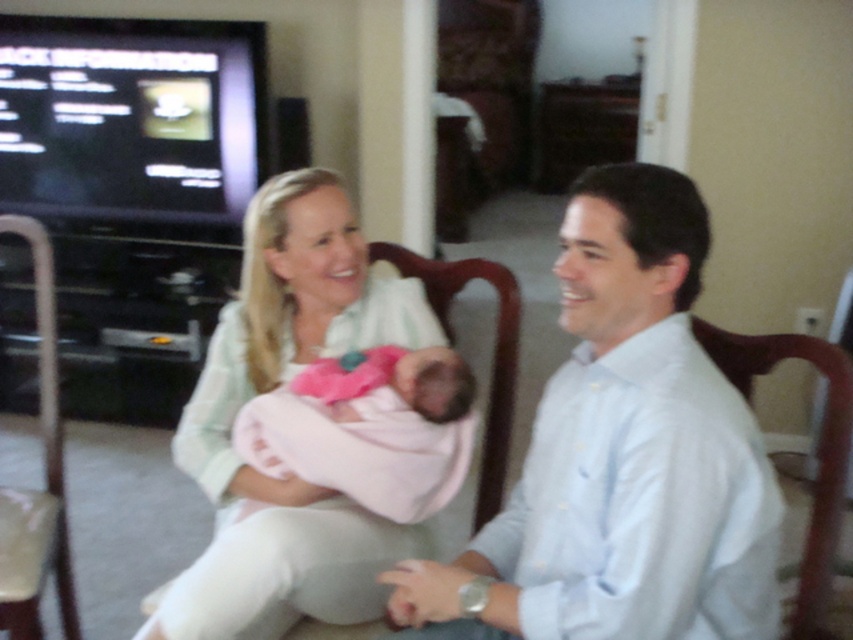
Question: In this image, where is pink fabric newborn at center located relative to light brown leather armchair at left?

Choices:
 (A) right
 (B) left

Answer: (A)

Question: Can you confirm if pink fabric newborn at center is positioned above dark wood armchair at right?

Choices:
 (A) yes
 (B) no

Answer: (A)

Question: Which object is farther from the camera taking this photo?

Choices:
 (A) light blue shirt at right
 (B) dark wood armchair at right
 (C) pink fabric newborn at center
 (D) light green fabric shirt at center

Answer: (C)

Question: Can you confirm if light blue shirt at right is thinner than pink fabric newborn at center?

Choices:
 (A) yes
 (B) no

Answer: (B)

Question: Which of the following is the closest to the observer?

Choices:
 (A) (628, 218)
 (B) (314, 292)
 (C) (415, 360)

Answer: (A)

Question: Based on their relative distances, which object is nearer to the light blue shirt at right?

Choices:
 (A) dark wood armchair at right
 (B) pink fabric newborn at center

Answer: (B)